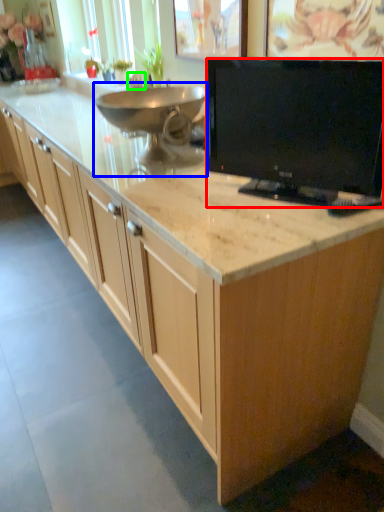
Question: Which is nearer to the television (highlighted by a red box)? appliance (highlighted by a blue box) or faucet (highlighted by a green box).

Choices:
 (A) appliance
 (B) faucet

Answer: (A)